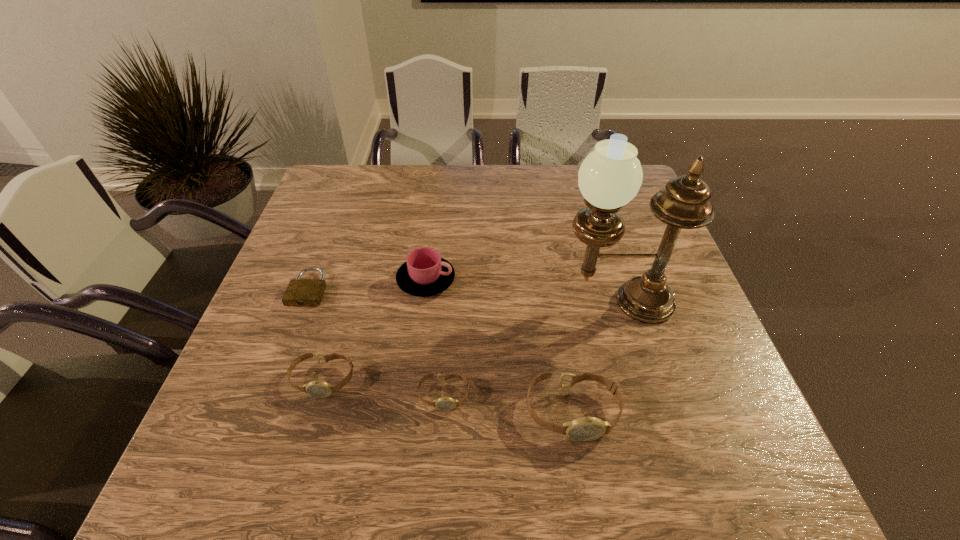
The width and height of the screenshot is (960, 540). I want to click on vacant space positioned on the keyhole side of the shortest object, so 291,338.

At what (x,y) coordinates should I click in order to perform the action: click on watch that is at the left edge. Please return your answer as a coordinate pair (x, y). This screenshot has width=960, height=540. Looking at the image, I should click on (320, 389).

Where is `padlock at the left edge`? This screenshot has width=960, height=540. padlock at the left edge is located at coordinates (301, 292).

Locate an element on the screen. This screenshot has height=540, width=960. object present at the right edge is located at coordinates (609, 177).

The width and height of the screenshot is (960, 540). I want to click on object present at the near left corner, so click(x=320, y=389).

Image resolution: width=960 pixels, height=540 pixels. In order to click on free space at the far edge in this screenshot , I will do `click(553, 192)`.

The height and width of the screenshot is (540, 960). What are the coordinates of `vacant space at the near edge` in the screenshot? It's located at (480, 430).

Where is `free space at the left edge`? Image resolution: width=960 pixels, height=540 pixels. free space at the left edge is located at coordinates (327, 222).

Where is `vacant space at the right edge of the desktop`? vacant space at the right edge of the desktop is located at coordinates (651, 228).

Find the location of a particular element. The width and height of the screenshot is (960, 540). free space between the tallest watch and the second shortest object is located at coordinates (508, 403).